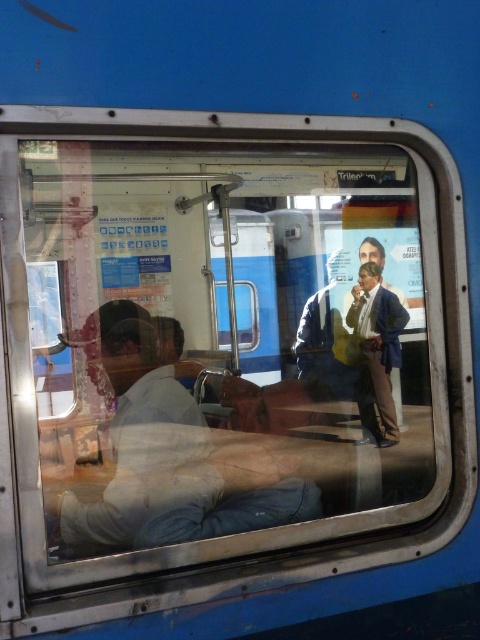
Question: Which point is closer to the camera?

Choices:
 (A) (122, 532)
 (B) (363, 424)

Answer: (A)

Question: Is light beige shirt at lower left to the left of matte blue suit at center from the viewer's perspective?

Choices:
 (A) yes
 (B) no

Answer: (A)

Question: Is light beige shirt at lower left wider than matte blue suit at center?

Choices:
 (A) yes
 (B) no

Answer: (A)

Question: Which point is closer to the camera taking this photo?

Choices:
 (A) (155, 448)
 (B) (362, 324)

Answer: (A)

Question: Which object is farther from the camera taking this photo?

Choices:
 (A) light beige shirt at lower left
 (B) matte blue suit at center

Answer: (B)

Question: Is light beige shirt at lower left wider than matte blue suit at center?

Choices:
 (A) no
 (B) yes

Answer: (B)